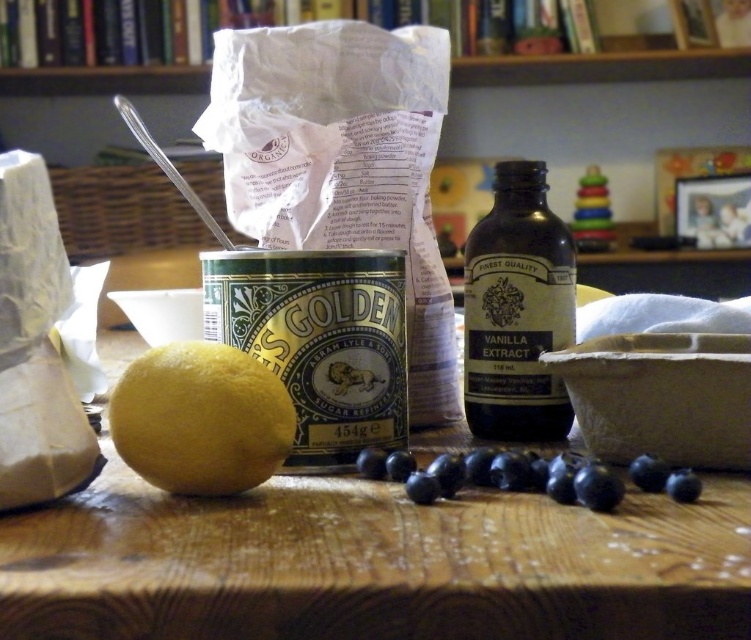
You are a chef preparing a recipe that requires both the dark brown glass bottle at center and the blue matte blueberries at center. You need to reach for the blueberries first. Which object should you move first to access the blueberries?

The blue matte blueberries at center are behind the dark brown glass bottle at center, so you should move the dark brown glass bottle at center first to access the blueberries.